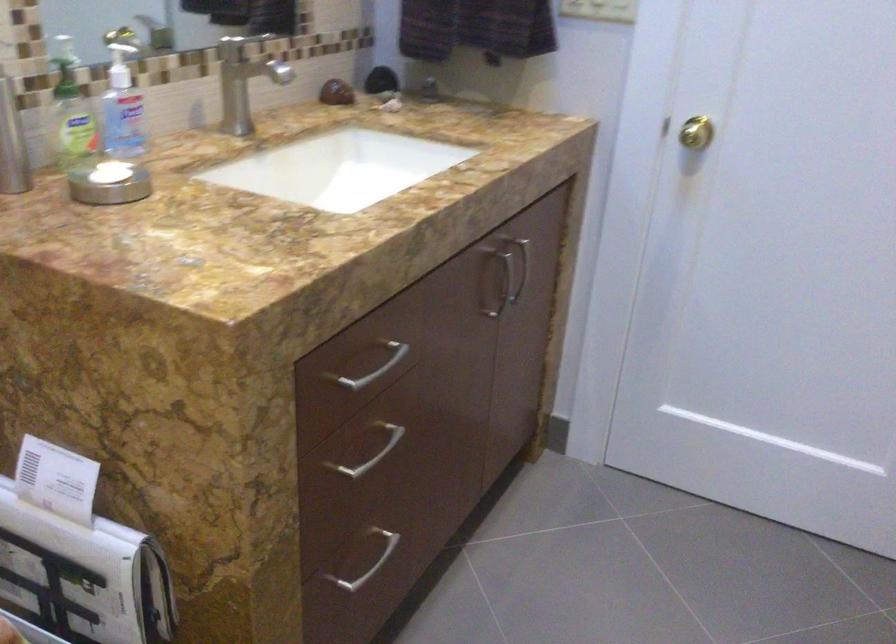
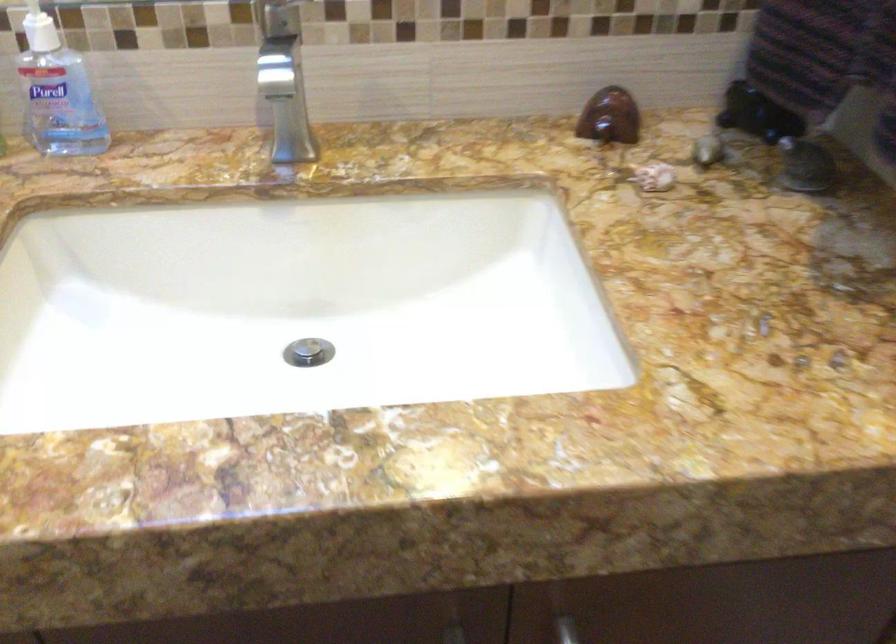
Locate, in the second image, the point that corresponds to pixel 364 113 in the first image.

(609, 117)